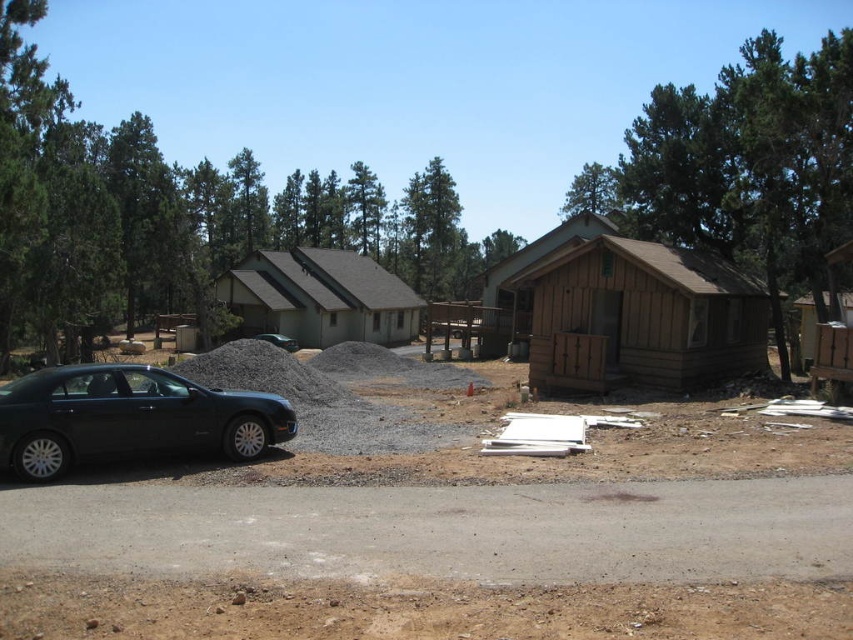
Question: Observing the image, what is the correct spatial positioning of brown wooden cabin at center-right in reference to black matte sedan at left?

Choices:
 (A) right
 (B) left

Answer: (A)

Question: Which object is the closest to the gray gravel pile at center?

Choices:
 (A) brown wooden cabin at center-right
 (B) brown wooden cabin at center

Answer: (A)

Question: Does gray gravel pile at center have a greater width compared to brown wooden cabin at center?

Choices:
 (A) no
 (B) yes

Answer: (A)

Question: Which point is closer to the camera taking this photo?

Choices:
 (A) (143, 365)
 (B) (276, 337)
 (C) (210, 387)

Answer: (A)

Question: Is green shingled cabin at center in front of green matte car at center?

Choices:
 (A) yes
 (B) no

Answer: (B)

Question: Which of the following is the closest to the observer?

Choices:
 (A) black matte sedan at left
 (B) brown dirt track at lower center
 (C) gray gravel pile at center
 (D) green shingled cabin at center

Answer: (B)